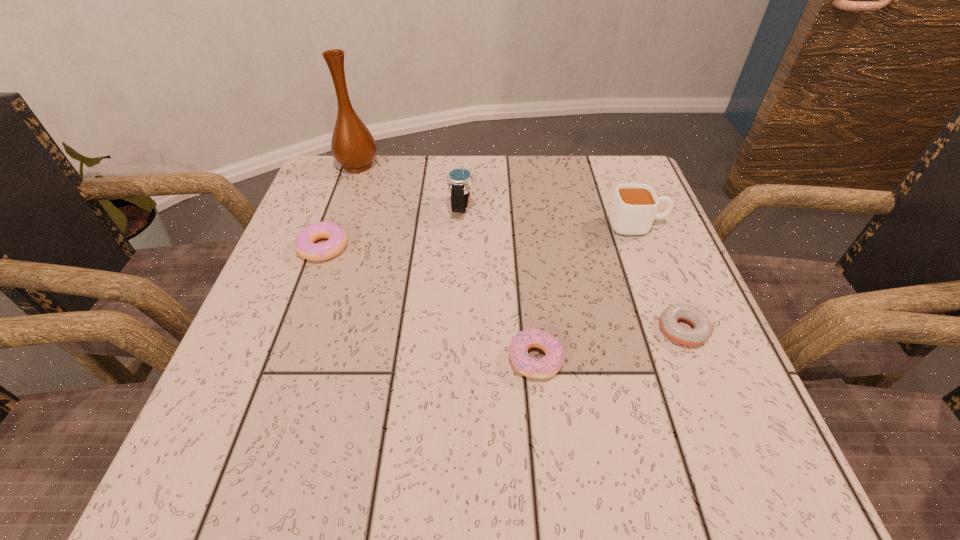
Image resolution: width=960 pixels, height=540 pixels. I want to click on vacant space located on the back of the leftmost doughnut, so click(x=336, y=214).

This screenshot has width=960, height=540. What are the coordinates of `free space located on the left of the second doughnut from left to right` in the screenshot? It's located at (269, 359).

Locate an element on the screen. free location located on the back of the shortest object is located at coordinates (651, 250).

At what (x,y) coordinates should I click in order to perform the action: click on vase that is at the far edge. Please return your answer as a coordinate pair (x, y). Looking at the image, I should click on (353, 146).

This screenshot has width=960, height=540. Find the location of `watch that is at the far edge`. watch that is at the far edge is located at coordinates (459, 180).

Identify the location of vase at the left edge. (353, 146).

This screenshot has width=960, height=540. In order to click on doughnut present at the left edge in this screenshot , I will do `click(304, 244)`.

Identify the location of cup present at the right edge. (633, 209).

The image size is (960, 540). In order to click on doughnut present at the right edge in this screenshot , I will do pos(702,328).

Identify the location of object at the far left corner. (353, 146).